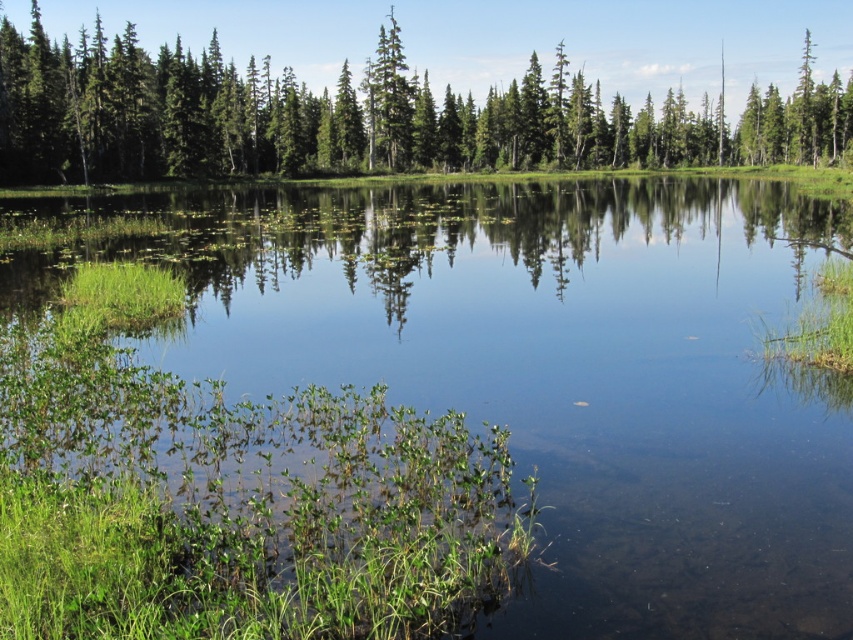
Question: Which point is farther from the camera taking this photo?

Choices:
 (A) (321, 100)
 (B) (598, 490)
 (C) (407, 102)

Answer: (A)

Question: Does clear water at center appear on the left side of green matte tree at center?

Choices:
 (A) no
 (B) yes

Answer: (B)

Question: Observing the image, what is the correct spatial positioning of green glossy trees at upper center in reference to green matte tree at center?

Choices:
 (A) right
 (B) left

Answer: (A)

Question: Which of the following is the closest to the observer?

Choices:
 (A) green matte tree at center
 (B) green glossy trees at upper center
 (C) clear water at center

Answer: (C)

Question: Which of these objects is positioned farthest from the green glossy trees at upper center?

Choices:
 (A) green matte tree at center
 (B) clear water at center

Answer: (B)

Question: Can you confirm if green glossy trees at upper center is positioned above green matte tree at center?

Choices:
 (A) yes
 (B) no

Answer: (A)